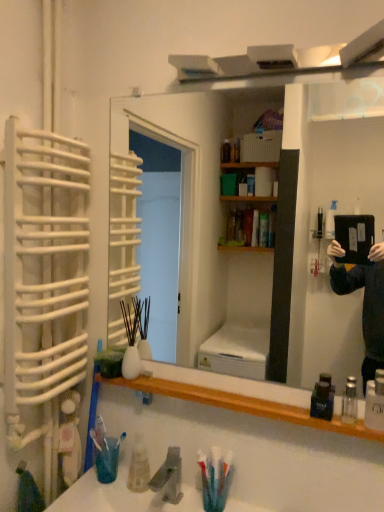
Question: Is wooden shelf at lower center surrounded by gray matte faucet at lower center?

Choices:
 (A) no
 (B) yes

Answer: (A)

Question: Can you confirm if gray matte faucet at lower center is shorter than wooden shelf at lower center?

Choices:
 (A) yes
 (B) no

Answer: (B)

Question: Is gray matte faucet at lower center thinner than wooden shelf at lower center?

Choices:
 (A) yes
 (B) no

Answer: (B)

Question: Considering the relative sizes of gray matte faucet at lower center and wooden shelf at lower center in the image provided, is gray matte faucet at lower center wider than wooden shelf at lower center?

Choices:
 (A) yes
 (B) no

Answer: (A)

Question: Does gray matte faucet at lower center have a greater height compared to wooden shelf at lower center?

Choices:
 (A) yes
 (B) no

Answer: (A)

Question: Considering the relative sizes of gray matte faucet at lower center and wooden shelf at lower center in the image provided, is gray matte faucet at lower center smaller than wooden shelf at lower center?

Choices:
 (A) yes
 (B) no

Answer: (A)

Question: Does wooden mirror at center have a larger size compared to clear glass bottle at lower right, placed as the first mouthwash when sorted from right to left?

Choices:
 (A) yes
 (B) no

Answer: (A)

Question: Considering the relative sizes of wooden mirror at center and clear glass bottle at lower right, placed as the first mouthwash when sorted from right to left, in the image provided, is wooden mirror at center taller than clear glass bottle at lower right, placed as the first mouthwash when sorted from right to left,?

Choices:
 (A) yes
 (B) no

Answer: (A)

Question: From a real-world perspective, is wooden mirror at center located beneath clear glass bottle at lower right, placed as the first mouthwash when sorted from right to left?

Choices:
 (A) no
 (B) yes

Answer: (A)

Question: Can you confirm if wooden mirror at center is positioned to the left of clear glass bottle at lower right, positioned as the second mouthwash in left-to-right order?

Choices:
 (A) yes
 (B) no

Answer: (A)

Question: Does wooden mirror at center turn towards clear glass bottle at lower right, placed as the first mouthwash when sorted from right to left?

Choices:
 (A) no
 (B) yes

Answer: (B)

Question: Considering the relative sizes of wooden mirror at center and clear glass bottle at lower right, positioned as the second mouthwash in left-to-right order, in the image provided, is wooden mirror at center shorter than clear glass bottle at lower right, positioned as the second mouthwash in left-to-right order,?

Choices:
 (A) yes
 (B) no

Answer: (B)

Question: Does white plastic toothbrush at left, positioned as the 2th toothbrush in right-to-left order, have a larger size compared to translucent plastic toothbrush at lower left, placed as the 2th toothbrush when sorted from left to right?

Choices:
 (A) yes
 (B) no

Answer: (A)